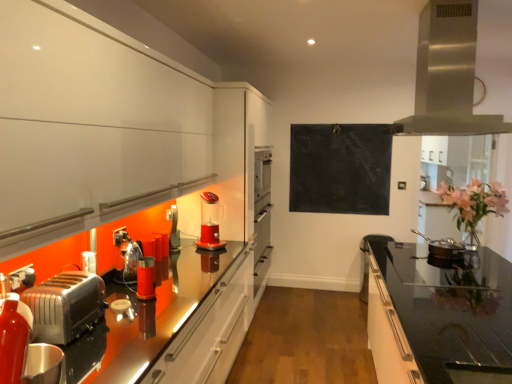
Question: Can metallic red canister at center, arranged as the second appliance when viewed from the back, be found inside black matte chalkboard at upper center?

Choices:
 (A) yes
 (B) no

Answer: (B)

Question: From the image's perspective, is black matte chalkboard at upper center under metallic red canister at center, arranged as the second appliance when viewed from the back?

Choices:
 (A) yes
 (B) no

Answer: (B)

Question: Are black matte chalkboard at upper center and metallic red canister at center, positioned as the 1th appliance in front-to-back order, beside each other?

Choices:
 (A) no
 (B) yes

Answer: (A)

Question: Considering the relative positions of black matte chalkboard at upper center and metallic red canister at center, the 2th appliance positioned from the right, in the image provided, is black matte chalkboard at upper center behind metallic red canister at center, the 2th appliance positioned from the right,?

Choices:
 (A) no
 (B) yes

Answer: (B)

Question: Is black matte chalkboard at upper center to the left of metallic red canister at center, positioned as the 1th appliance in front-to-back order, from the viewer's perspective?

Choices:
 (A) yes
 (B) no

Answer: (B)

Question: Does black matte chalkboard at upper center have a larger size compared to metallic red canister at center, the 2th appliance positioned from the right?

Choices:
 (A) yes
 (B) no

Answer: (A)

Question: Is the depth of translucent plastic blender at center less than that of pink floral bouquet at right?

Choices:
 (A) no
 (B) yes

Answer: (A)

Question: Could you tell me if translucent plastic blender at center is turned towards pink floral bouquet at right?

Choices:
 (A) yes
 (B) no

Answer: (B)

Question: Is translucent plastic blender at center positioned with its back to pink floral bouquet at right?

Choices:
 (A) yes
 (B) no

Answer: (B)

Question: Does translucent plastic blender at center have a lesser width compared to pink floral bouquet at right?

Choices:
 (A) no
 (B) yes

Answer: (B)

Question: Considering the relative sizes of translucent plastic blender at center and pink floral bouquet at right in the image provided, is translucent plastic blender at center shorter than pink floral bouquet at right?

Choices:
 (A) yes
 (B) no

Answer: (A)

Question: Would you say pink floral bouquet at right is part of translucent plastic blender at center's contents?

Choices:
 (A) yes
 (B) no

Answer: (B)

Question: Is shiny silver pan at right, the 2th appliance in the left-to-right sequence, shorter than black glass countertop at right?

Choices:
 (A) no
 (B) yes

Answer: (B)